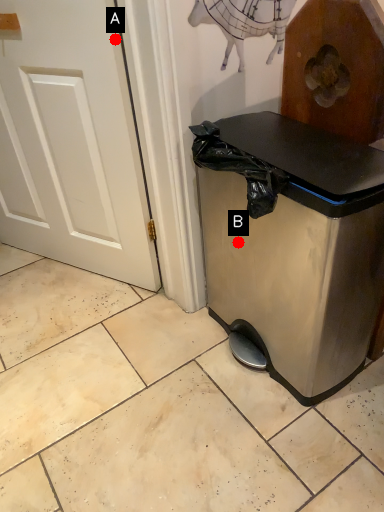
Question: Two points are circled on the image, labeled by A and B beside each circle. Which point is farther from the camera taking this photo?

Choices:
 (A) A is further
 (B) B is further

Answer: (B)